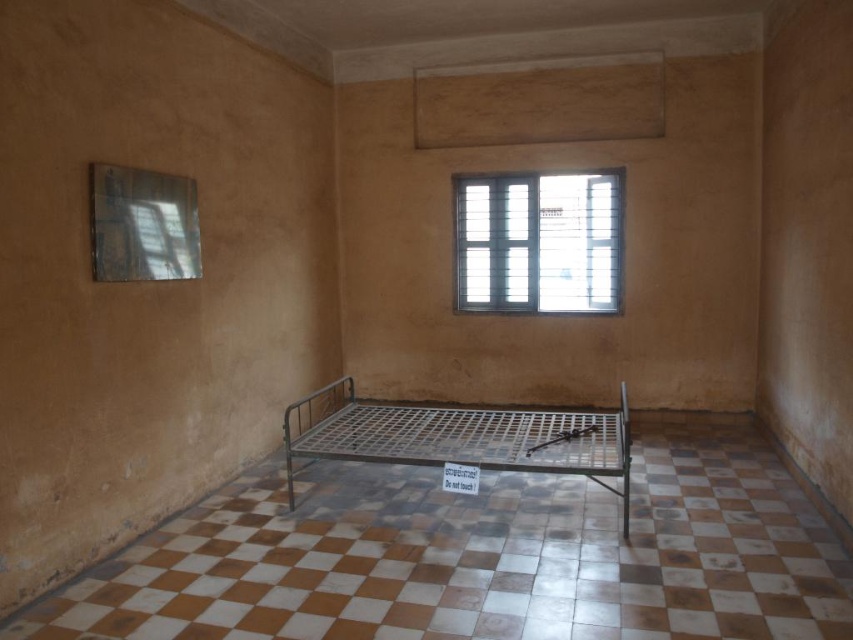
You are standing in the room and want to know if you can see the metallic grid bed at center through the clear glass window at upper center. Can you see it?

The clear glass window at upper center has a greater height compared to the metallic grid bed at center, so yes, you can see the metallic grid bed at center through the clear glass window at upper center because the window is taller and likely provides an unobstructed view.